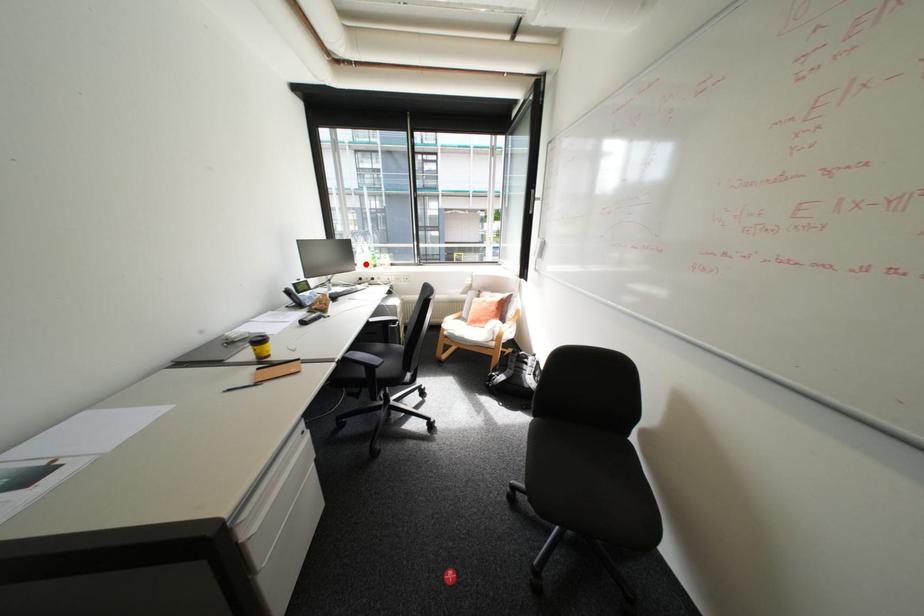
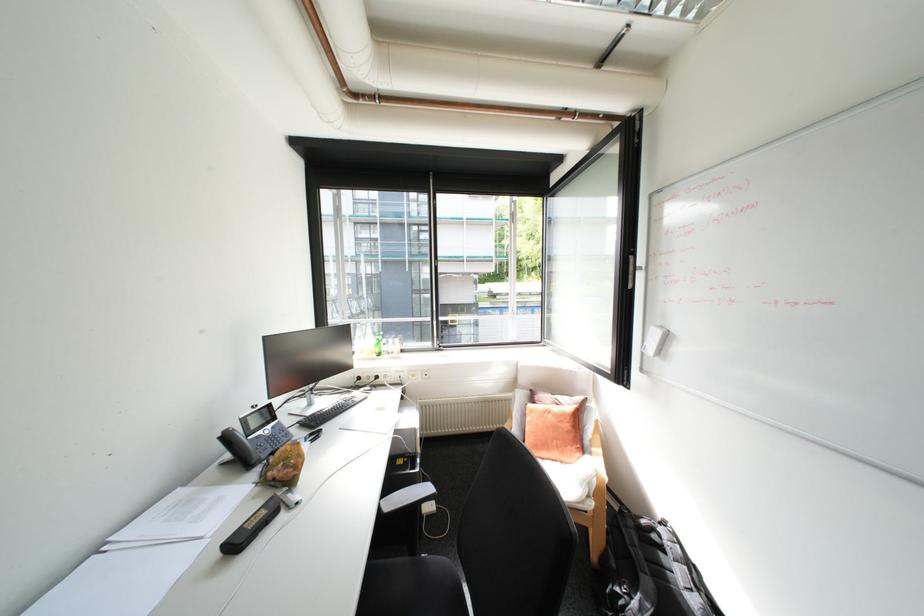
Question: I am providing you with two images of the same scene from different viewpoints. Image1 has a red point marked. In image2, the corresponding 3D location appears at what relative position? Reply with the corresponding letter.

Choices:
 (A) Closer
 (B) Farther

Answer: (B)